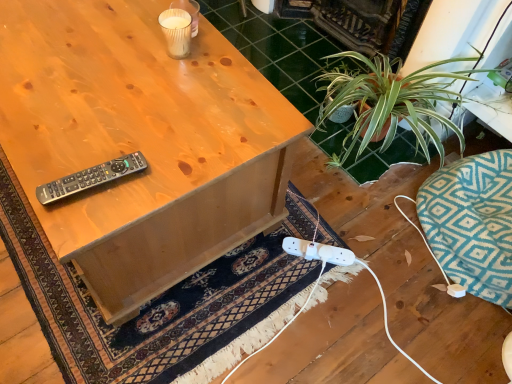
Locate an element on the screen. The width and height of the screenshot is (512, 384). space that is in front of black plastic remote at upper left is located at coordinates [80, 217].